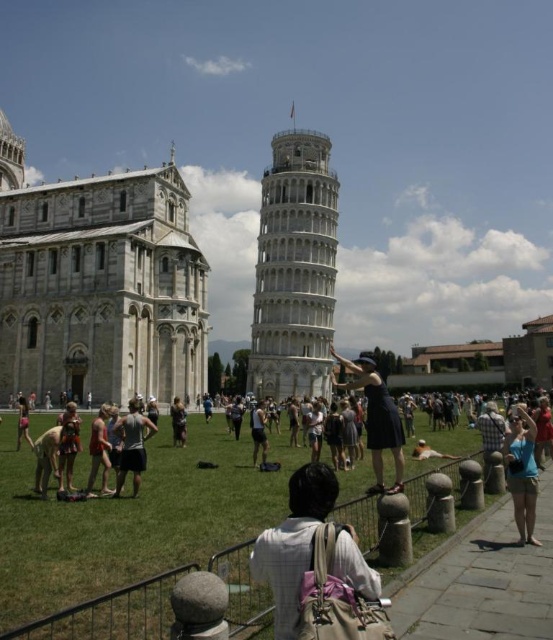
Is light gray backpack at center thinner than dark gray fabric shorts at center?

Yes.

What do you see at coordinates (293, 541) in the screenshot? I see `light gray backpack at center` at bounding box center [293, 541].

Locate an element on the screen. The height and width of the screenshot is (640, 553). light gray backpack at center is located at coordinates (293, 541).

Consider the image. Which is below, blue denim shorts at lower right or dark gray fabric shorts at center?

blue denim shorts at lower right is below.

Does blue denim shorts at lower right have a larger size compared to dark gray fabric shorts at center?

Incorrect, blue denim shorts at lower right is not larger than dark gray fabric shorts at center.

The image size is (553, 640). Describe the element at coordinates (521, 472) in the screenshot. I see `blue denim shorts at lower right` at that location.

I want to click on blue denim shorts at lower right, so click(521, 472).

Is point (384, 433) more distant than point (128, 404)?

No, (384, 433) is closer to viewer.

Does dark blue dress at center have a larger size compared to dark gray fabric shorts at center?

Yes, dark blue dress at center is bigger than dark gray fabric shorts at center.

Looking at this image, who is more distant from viewer, (x=346, y=358) or (x=133, y=460)?

Positioned behind is point (x=346, y=358).

Find the location of `dark blue dress at center`. dark blue dress at center is located at coordinates (377, 417).